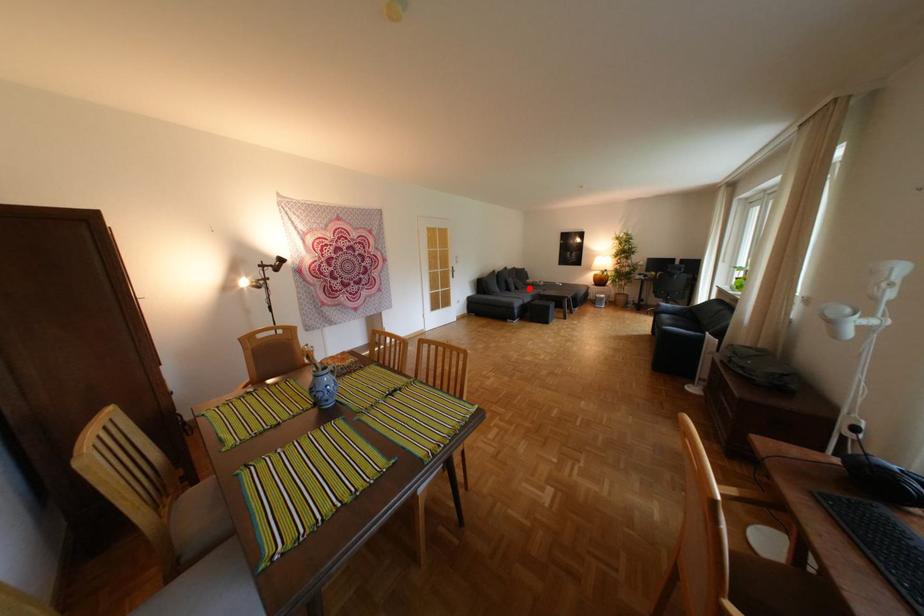
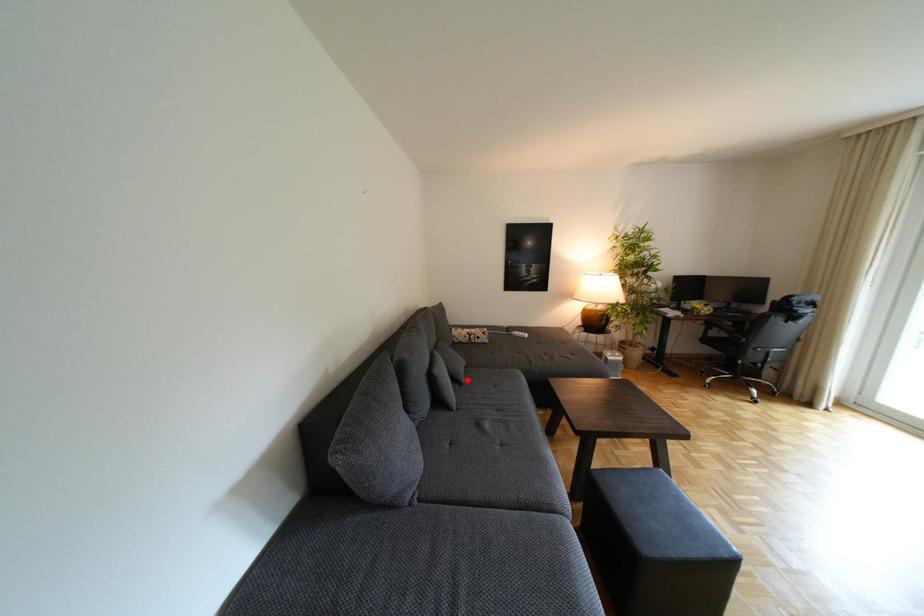
I am providing you with two images of the same scene from different viewpoints. A red point is marked on the first image and another point is marked on the second image. Are the points marked in image1 and image2 representing the same 3D position?

Yes